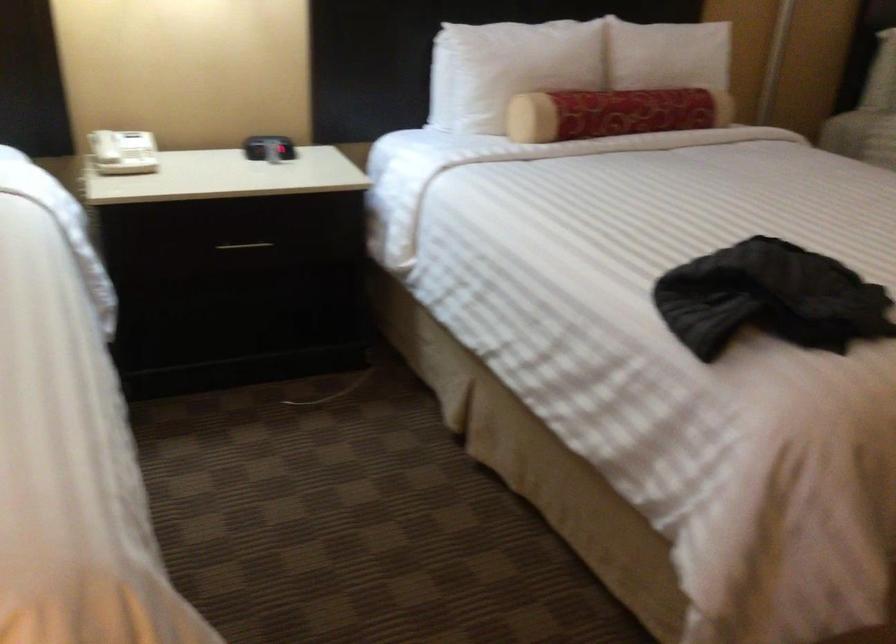
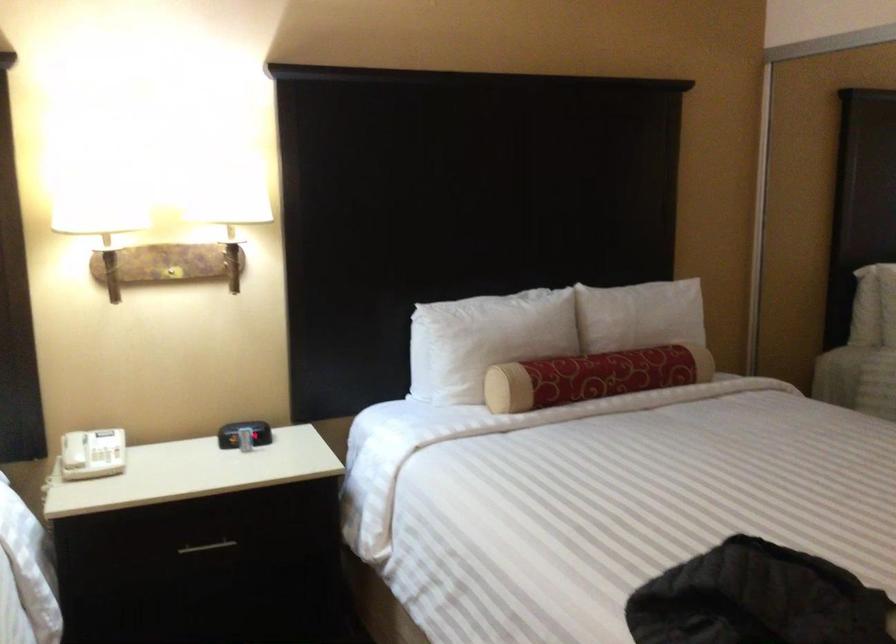
Locate, in the second image, the point that corresponds to point (276, 146) in the first image.

(244, 433)